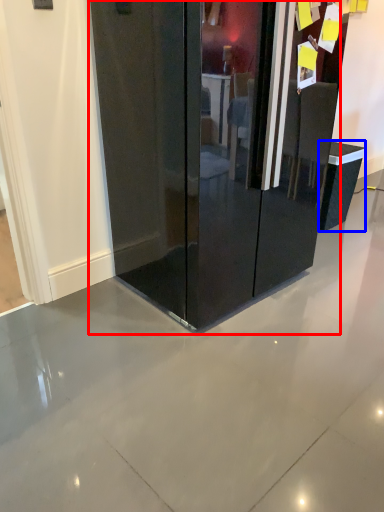
Question: Which of the following is the farthest to the observer, glass door (highlighted by a red box) or furniture (highlighted by a blue box)?

Choices:
 (A) glass door
 (B) furniture

Answer: (B)